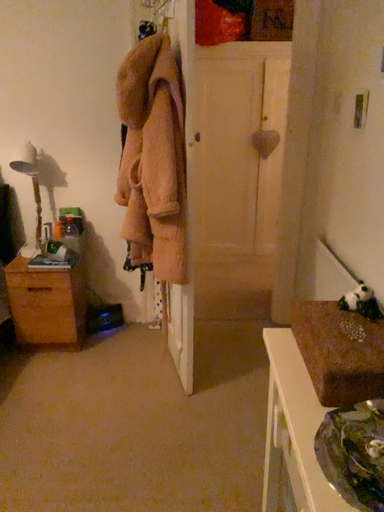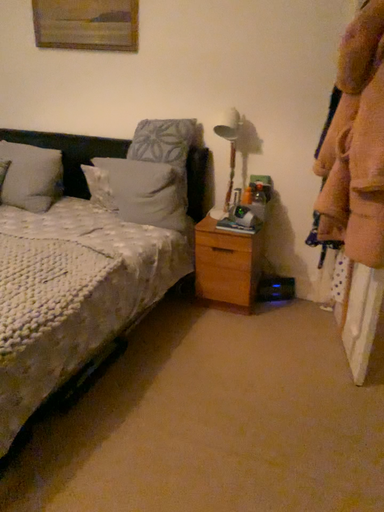
Question: How did the camera likely rotate when shooting the video?

Choices:
 (A) rotated left
 (B) rotated right

Answer: (A)